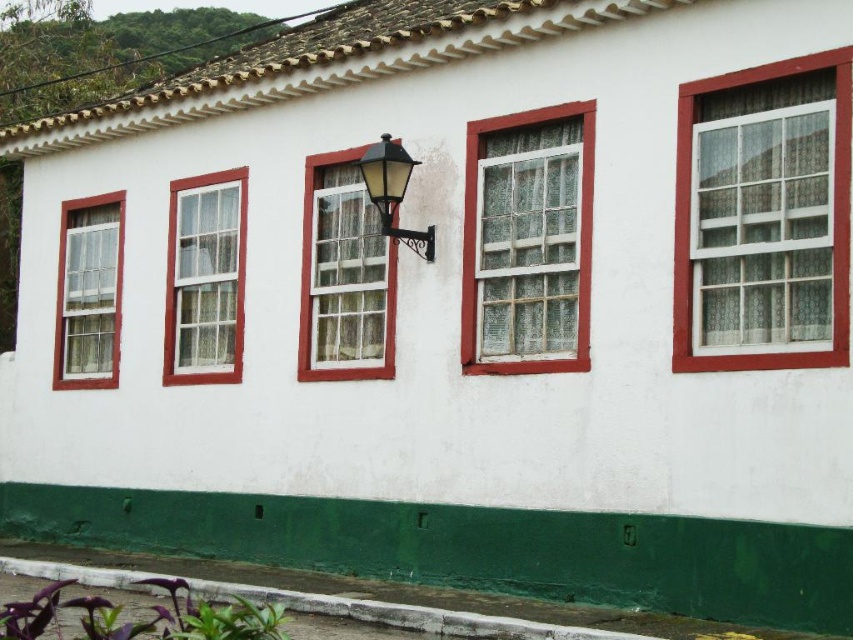
You are an architect designing a new building facade. You have two glass panels to place on the wall between the existing windows. The first is a white glass window at center left, and the second is a matte yellow glass at center. Based on the scene description, which glass panel is wider?

The white glass window at center left is wider than the matte yellow glass at center according to the description.

You are standing in front of the white building with red window frames. You notice two points marked on the wall. The first point is at coordinate (683,284) and the second is at (84,230). From your perspective, which point appears closer to you?

Point (683,284) is in front of point (84,230), so it appears closer to you.

You are standing in front of a building with five windows and a decorative lantern. You notice a point marked at coordinates (206, 278). Which object corresponds to this point?

The white glass window at center left corresponds to the point marked at coordinates (206, 278).